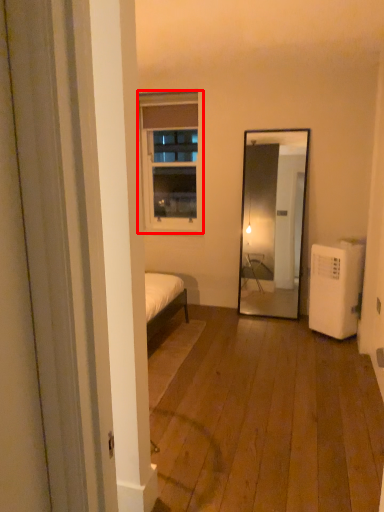
Question: Where is window (annotated by the red box) located in relation to air conditioner in the image?

Choices:
 (A) left
 (B) right

Answer: (A)